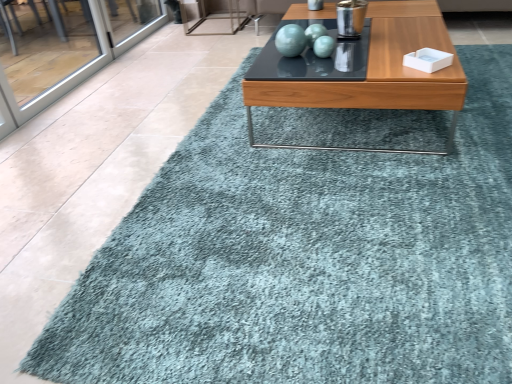
Measure the distance between point (305, 41) and camera.

The distance of point (305, 41) from camera is 1.74 meters.

Describe the element at coordinates (290, 40) in the screenshot. I see `matte turquoise sphere at center` at that location.

Identify the location of matte turquoise sphere at center. The image size is (512, 384). (290, 40).

What is the approximate height of matte turquoise sphere at center?

The height of matte turquoise sphere at center is 4.92 inches.

This screenshot has height=384, width=512. What do you see at coordinates (378, 74) in the screenshot?
I see `wooden glossy coffee table at center` at bounding box center [378, 74].

Where is `wooden glossy coffee table at center`? This screenshot has width=512, height=384. wooden glossy coffee table at center is located at coordinates pos(378,74).

What are the coordinates of `matte turquoise sphere at center` in the screenshot? It's located at (290, 40).

Considering the positions of objects wooden glossy coffee table at center and matte turquoise sphere at center in the image provided, who is more to the right, wooden glossy coffee table at center or matte turquoise sphere at center?

From the viewer's perspective, wooden glossy coffee table at center appears more on the right side.

Which object is further away from the camera taking this photo, wooden glossy coffee table at center or matte turquoise sphere at center?

matte turquoise sphere at center is more distant.

Is point (312, 146) positioned behind point (286, 27)?

No, (312, 146) is closer to viewer.

From the image's perspective, between wooden glossy coffee table at center and matte turquoise sphere at center, who is located below?

wooden glossy coffee table at center.

From a real-world perspective, is wooden glossy coffee table at center positioned under matte turquoise sphere at center based on gravity?

Yes.

Between wooden glossy coffee table at center and matte turquoise sphere at center, which one has smaller width?

Thinner between the two is matte turquoise sphere at center.

Can you confirm if wooden glossy coffee table at center is shorter than matte turquoise sphere at center?

No, wooden glossy coffee table at center is not shorter than matte turquoise sphere at center.

Who is smaller, wooden glossy coffee table at center or matte turquoise sphere at center?

matte turquoise sphere at center.

Is wooden glossy coffee table at center located outside matte turquoise sphere at center?

Absolutely, wooden glossy coffee table at center is external to matte turquoise sphere at center.

Is wooden glossy coffee table at center far away from matte turquoise sphere at center?

No, wooden glossy coffee table at center is in close proximity to matte turquoise sphere at center.

Is matte turquoise sphere at center at the back of wooden glossy coffee table at center?

No.

How far apart are wooden glossy coffee table at center and matte turquoise sphere at center?

The distance of wooden glossy coffee table at center from matte turquoise sphere at center is 18.10 inches.

The image size is (512, 384). I want to click on coffee table beneath the matte turquoise sphere at center (from a real-world perspective), so click(378, 74).

Is matte turquoise sphere at center at the left side of wooden glossy coffee table at center?

Yes, matte turquoise sphere at center is to the left of wooden glossy coffee table at center.

In the image, is matte turquoise sphere at center positioned in front of or behind wooden glossy coffee table at center?

In the image, matte turquoise sphere at center appears behind wooden glossy coffee table at center.

Which is behind, point (279, 36) or point (463, 96)?

The point (279, 36) is behind.

From the image's perspective, does matte turquoise sphere at center appear lower than wooden glossy coffee table at center?

Incorrect, from the image's perspective, matte turquoise sphere at center is higher than wooden glossy coffee table at center.

From a real-world perspective, is matte turquoise sphere at center positioned above or below wooden glossy coffee table at center?

Clearly, from a real-world perspective, matte turquoise sphere at center is above wooden glossy coffee table at center.

Is matte turquoise sphere at center thinner than wooden glossy coffee table at center?

Correct, the width of matte turquoise sphere at center is less than that of wooden glossy coffee table at center.

Between matte turquoise sphere at center and wooden glossy coffee table at center, which one has less height?

With less height is matte turquoise sphere at center.

Considering the sizes of objects matte turquoise sphere at center and wooden glossy coffee table at center in the image provided, who is smaller, matte turquoise sphere at center or wooden glossy coffee table at center?

Smaller between the two is matte turquoise sphere at center.

Is matte turquoise sphere at center not within wooden glossy coffee table at center?

Yes, matte turquoise sphere at center is outside of wooden glossy coffee table at center.

Would you consider matte turquoise sphere at center to be distant from wooden glossy coffee table at center?

matte turquoise sphere at center is near wooden glossy coffee table at center, not far away.

Looking at this image, could you tell me if matte turquoise sphere at center is facing wooden glossy coffee table at center?

No, matte turquoise sphere at center is not aimed at wooden glossy coffee table at center.

How many degrees apart are the facing directions of matte turquoise sphere at center and wooden glossy coffee table at center?

matte turquoise sphere at center and wooden glossy coffee table at center are facing 0.000327 degrees away from each other.

I want to click on turquoise lying above the wooden glossy coffee table at center (from the image's perspective), so click(290, 40).

Locate an element on the screen. The height and width of the screenshot is (384, 512). turquoise on the left side of wooden glossy coffee table at center is located at coordinates (290, 40).

The height and width of the screenshot is (384, 512). What are the coordinates of `coffee table that appears on the right of matte turquoise sphere at center` in the screenshot? It's located at (378, 74).